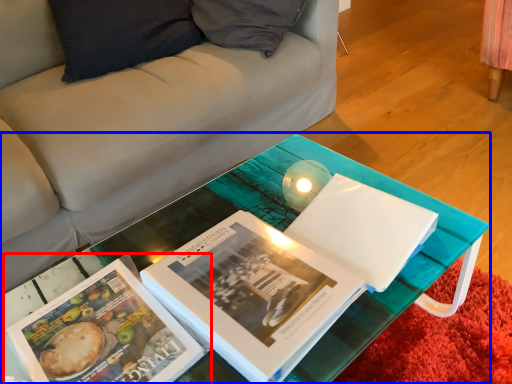
Question: Which point is closer to the camera, book (highlighted by a red box) or table (highlighted by a blue box)?

Choices:
 (A) book
 (B) table

Answer: (B)